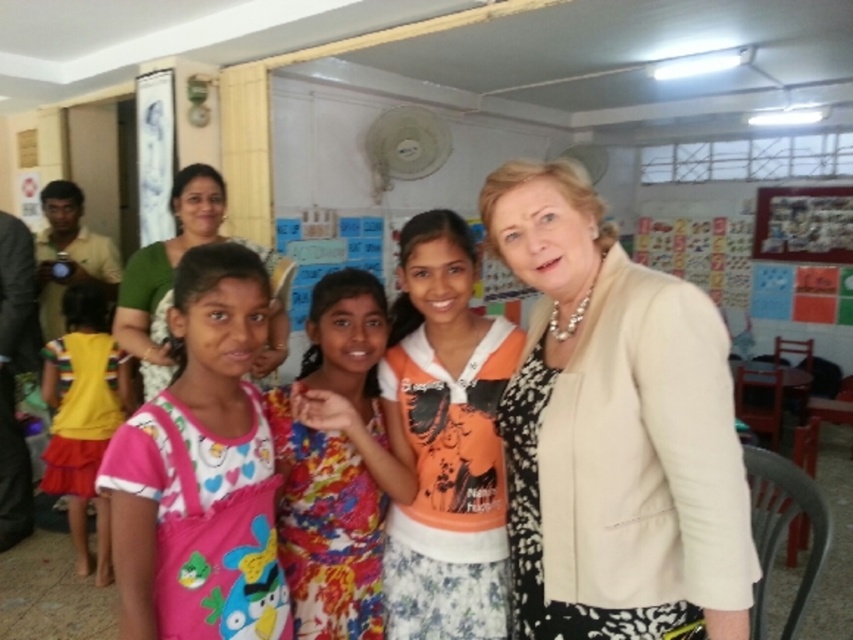
You are standing in the classroom and want to touch both the beige fabric jacket at center and the green fabric at upper left. Which one can you reach first without moving your position?

You can reach the beige fabric jacket at center first because it is closer to you than the green fabric at upper left.

You are a photographer standing in the classroom. You need to adjust the lighting so that both the beige fabric jacket at center and the green fabric at upper left are well lit. Given that your spotlight can cover a radius of 4 feet, can you light both areas with a single spotlight?

The beige fabric jacket at center and green fabric at upper left are 4.55 feet apart from each other. Since the spotlight can only cover 4 feet in radius, the distance between them exceeds the coverage, so you need at least two spotlights to ensure both areas are well lit.